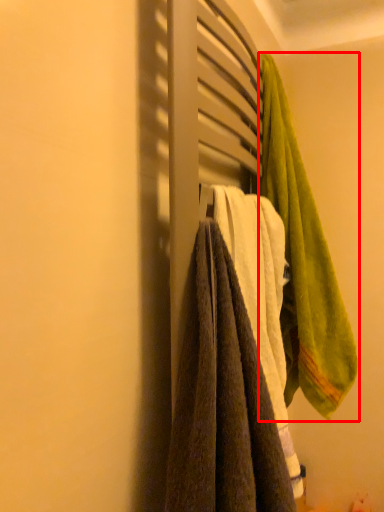
Question: From the image's perspective, considering the relative positions of towel (annotated by the red box) and towel in the image provided, where is towel (annotated by the red box) located with respect to the staircase?

Choices:
 (A) below
 (B) above

Answer: (B)